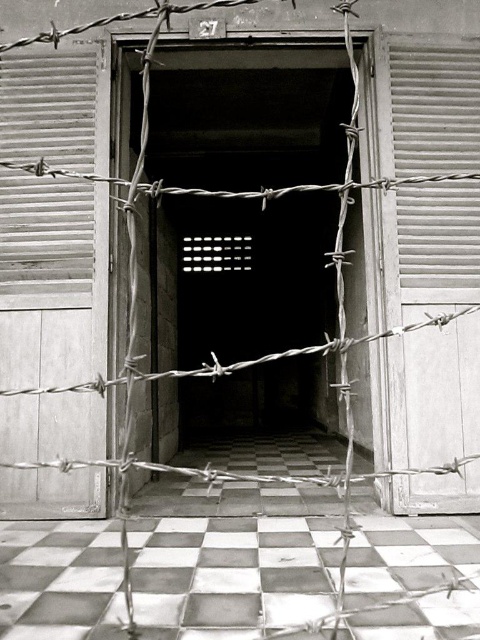
You are standing in front of the doorway marked with the number 27. You need to enter the room but notice two barriers on the right side of the doorway. Which barrier is closer to the entrance, the metallic corrugated door at right or the white wooden shutter at right?

The metallic corrugated door at right is closer to the entrance because it is positioned to the left of the white wooden shutter at right, meaning it is in front of the shutter when approaching the doorway.

You are a security guard positioned at the entrance of the building. You need to locate the metallic corrugated shutter at left. Where should you look relative to the doorway?

The metallic corrugated shutter at left is located at point 0.167 on the x axis and 0.102 on the y axis relative to the doorway.

You are a delivery person with a box that is 1.2 meters wide. You need to pass through the space between the metallic corrugated door at right and the metallic corrugated shutter at left. Will your box fit through the gap between them?

The metallic corrugated door at right and metallic corrugated shutter at left are 1.19 meters apart from each other. Since the box is 1.2 meters wide, it will not fit through the gap between them.